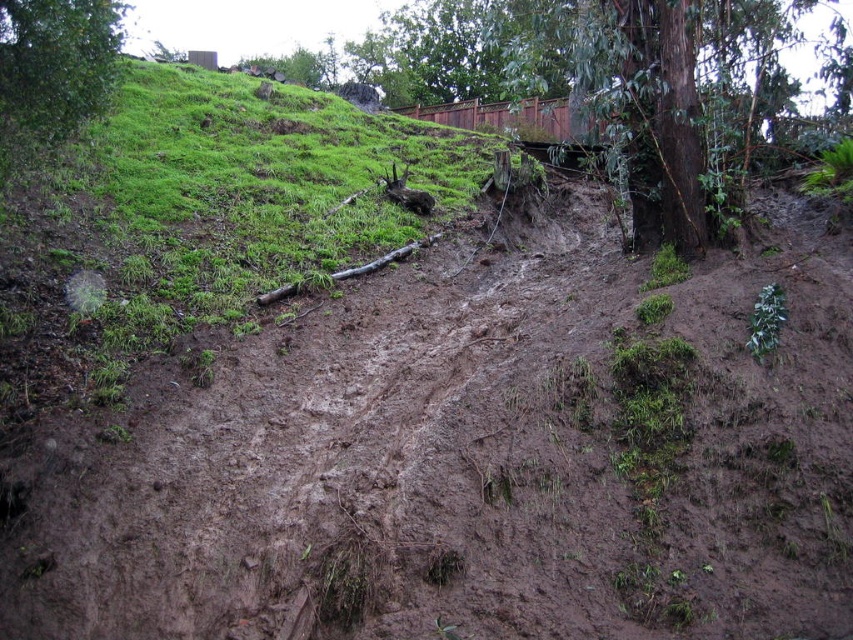
You are a hiker who wants to cross from the brown muddy dirt track at center to the green grassy at upper left. The path is 9.06 meters long. If your hiking boots have a grip that can handle slopes up to 10 meters, will you be able to safely cross the distance?

The distance between the brown muddy dirt track at center and the green grassy at upper left is 9.06 meters. Since your hiking boots can handle slopes up to 10 meters, you can safely cross the distance.

You are a hiker trying to navigate through the brown muddy dirt track at center. You notice a green leafy tree at upper left nearby. Which one is wider in width?

The green leafy tree at upper left is wider than the brown muddy dirt track at center.

You are a geologist examining the slope. You notice a point marked at coordinates [202,216]. Based on the scene, what does this point likely represent?

The point at [202,216] likely represents the green grassy area at the upper left of the slope, indicating a less disturbed region with stable vegetation compared to the muddy and eroded foreground.